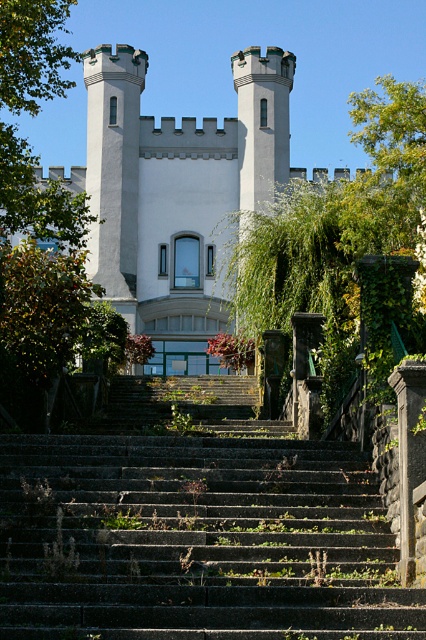
Does dark gray stone stairs at center come behind white stone castle at center?

No.

Between point (80, 509) and point (247, 67), which one is positioned behind?

The point (247, 67) is behind.

Find the location of a particular element. The width and height of the screenshot is (426, 640). dark gray stone stairs at center is located at coordinates (195, 529).

Is point (184, 285) less distant than point (14, 179)?

That is False.

Does white stone castle at center have a larger size compared to green leafy tree at upper left?

Incorrect, white stone castle at center is not larger than green leafy tree at upper left.

Where is `white stone castle at center`? The image size is (426, 640). white stone castle at center is located at coordinates (175, 188).

Is point (40, 637) behind point (422, 163)?

No, it is not.

Who is shorter, dark gray stone stairs at center or green leafy tree at center?

dark gray stone stairs at center is shorter.

Is point (13, 577) in front of point (284, 284)?

Yes, point (13, 577) is in front of point (284, 284).

Find the location of a particular element. dark gray stone stairs at center is located at coordinates (195, 529).